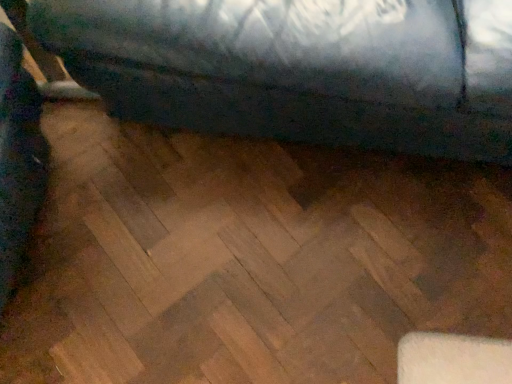
Measure the distance between point (77, 79) and camera.

Point (77, 79) and camera are 34.09 inches apart.

Find the location of a particular element. metallic blue mattress at upper center is located at coordinates pos(298,68).

Describe the element at coordinates (298, 68) in the screenshot. This screenshot has width=512, height=384. I see `metallic blue mattress at upper center` at that location.

Identify the location of metallic blue mattress at upper center. Image resolution: width=512 pixels, height=384 pixels. (298, 68).